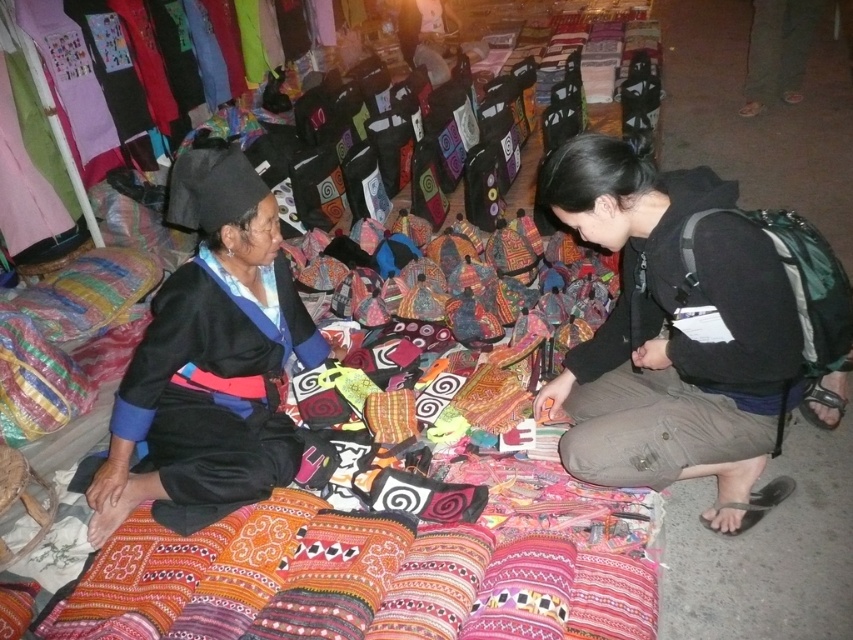
Question: Which object appears farthest from the camera in this image?

Choices:
 (A) black cotton pants at lower right
 (B) black matte dress at left

Answer: (B)

Question: Is black cotton pants at lower right above black matte dress at left?

Choices:
 (A) yes
 (B) no

Answer: (B)

Question: Can you confirm if black cotton pants at lower right is positioned to the left of black matte dress at left?

Choices:
 (A) no
 (B) yes

Answer: (A)

Question: Is black cotton pants at lower right wider than black matte dress at left?

Choices:
 (A) no
 (B) yes

Answer: (B)